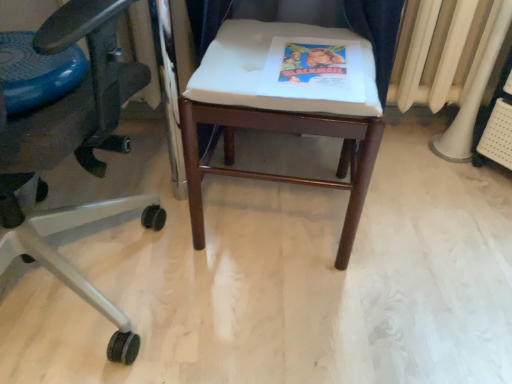
Question: Does matte paper book at center have a smaller size compared to matte black office chair at left?

Choices:
 (A) no
 (B) yes

Answer: (B)

Question: Can you confirm if matte paper book at center is taller than matte black office chair at left?

Choices:
 (A) no
 (B) yes

Answer: (A)

Question: From a real-world perspective, is matte paper book at center positioned over matte black office chair at left based on gravity?

Choices:
 (A) no
 (B) yes

Answer: (B)

Question: Can you confirm if matte paper book at center is wider than matte black office chair at left?

Choices:
 (A) no
 (B) yes

Answer: (A)

Question: From the image's perspective, does matte paper book at center appear higher than matte black office chair at left?

Choices:
 (A) no
 (B) yes

Answer: (B)

Question: Is matte paper book at center surrounding matte black office chair at left?

Choices:
 (A) no
 (B) yes

Answer: (A)

Question: Is white plastic radiator at right completely or partially outside of matte black office chair at left?

Choices:
 (A) yes
 (B) no

Answer: (A)

Question: Does white plastic radiator at right appear on the right side of matte black office chair at left?

Choices:
 (A) yes
 (B) no

Answer: (A)

Question: Can matte black office chair at left be found inside white plastic radiator at right?

Choices:
 (A) yes
 (B) no

Answer: (B)

Question: From a real-world perspective, is white plastic radiator at right located beneath matte black office chair at left?

Choices:
 (A) yes
 (B) no

Answer: (A)

Question: Does white plastic radiator at right appear on the left side of matte black office chair at left?

Choices:
 (A) no
 (B) yes

Answer: (A)

Question: Is white plastic radiator at right positioned in front of matte black office chair at left?

Choices:
 (A) no
 (B) yes

Answer: (A)

Question: Is blue rubber ball at left not inside white plastic radiator at right?

Choices:
 (A) no
 (B) yes

Answer: (B)